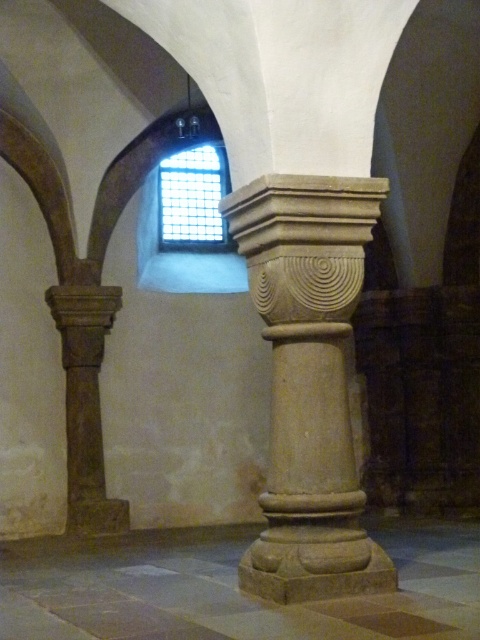
You are an architect examining the interior of a historical building. You notice two columns, the beige stone column at center and the smooth stone column at center. Which one has a greater height?

The beige stone column at center is taller than the smooth stone column at center.

You are an architect analyzing the spatial layout of this historical building. You need to determine which object occupies more space in the image between the brown stone column at left and the clear glass window at upper center. Based on the scene, which one is bigger?

The brown stone column at left has a larger size compared to the clear glass window at upper center, so the brown stone column at left occupies more space in the image.

You are standing inside a historical building and want to determine which of the two points, point (298, 422) or point (225, 230), is nearer to you. Based on the scene, which point is closer?

Point (298, 422) is closer to the viewer than point (225, 230).